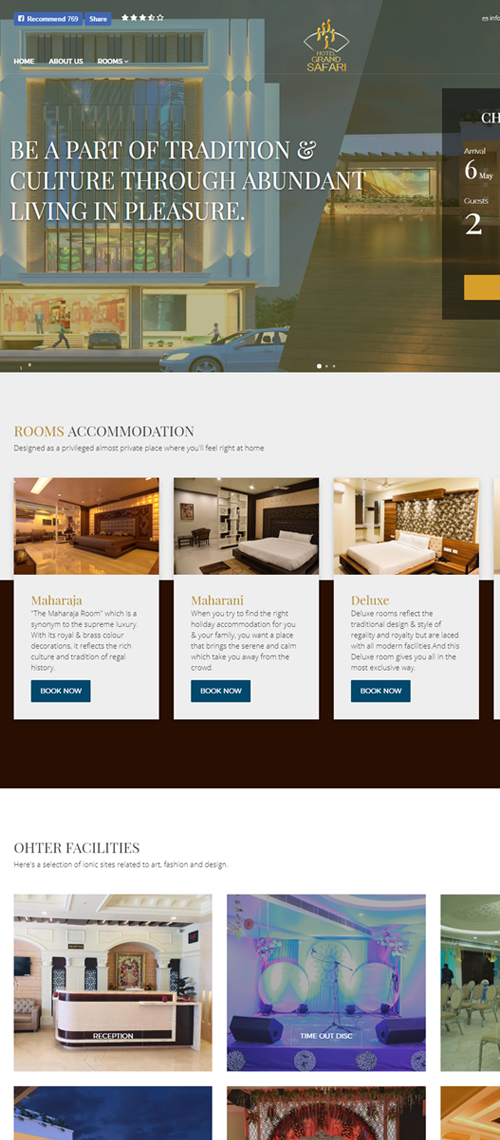
Identify the location of pillows. (415, 537), (294, 532).